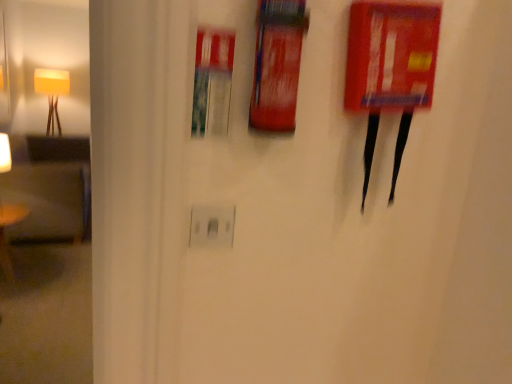
Question: Does red plastic fire extinguisher at upper right appear on the left side of yellow fabric lampshade at left?

Choices:
 (A) no
 (B) yes

Answer: (A)

Question: Are red plastic fire extinguisher at upper right and yellow fabric lampshade at left making contact?

Choices:
 (A) no
 (B) yes

Answer: (A)

Question: From a real-world perspective, is red plastic fire extinguisher at upper right positioned under yellow fabric lampshade at left based on gravity?

Choices:
 (A) yes
 (B) no

Answer: (B)

Question: Does red plastic fire extinguisher at upper right turn towards yellow fabric lampshade at left?

Choices:
 (A) no
 (B) yes

Answer: (A)

Question: Is red plastic fire extinguisher at upper right taller than yellow fabric lampshade at left?

Choices:
 (A) yes
 (B) no

Answer: (B)

Question: From the image's perspective, is red plastic fire extinguisher at upper right under yellow fabric lampshade at left?

Choices:
 (A) no
 (B) yes

Answer: (B)

Question: Considering the relative sizes of wooden table at left and red plastic fire extinguisher at upper right in the image provided, is wooden table at left smaller than red plastic fire extinguisher at upper right?

Choices:
 (A) yes
 (B) no

Answer: (B)

Question: Is wooden table at left located outside red plastic fire extinguisher at upper right?

Choices:
 (A) no
 (B) yes

Answer: (B)

Question: Does wooden table at left have a greater width compared to red plastic fire extinguisher at upper right?

Choices:
 (A) yes
 (B) no

Answer: (A)

Question: From the image's perspective, is wooden table at left above red plastic fire extinguisher at upper right?

Choices:
 (A) no
 (B) yes

Answer: (A)

Question: Can you confirm if wooden table at left is thinner than red plastic fire extinguisher at upper right?

Choices:
 (A) no
 (B) yes

Answer: (A)

Question: Does wooden table at left appear on the left side of red plastic fire extinguisher at upper right?

Choices:
 (A) no
 (B) yes

Answer: (B)

Question: Is there a large distance between yellow fabric lampshade at left and red plastic fire extinguisher at upper right?

Choices:
 (A) yes
 (B) no

Answer: (A)